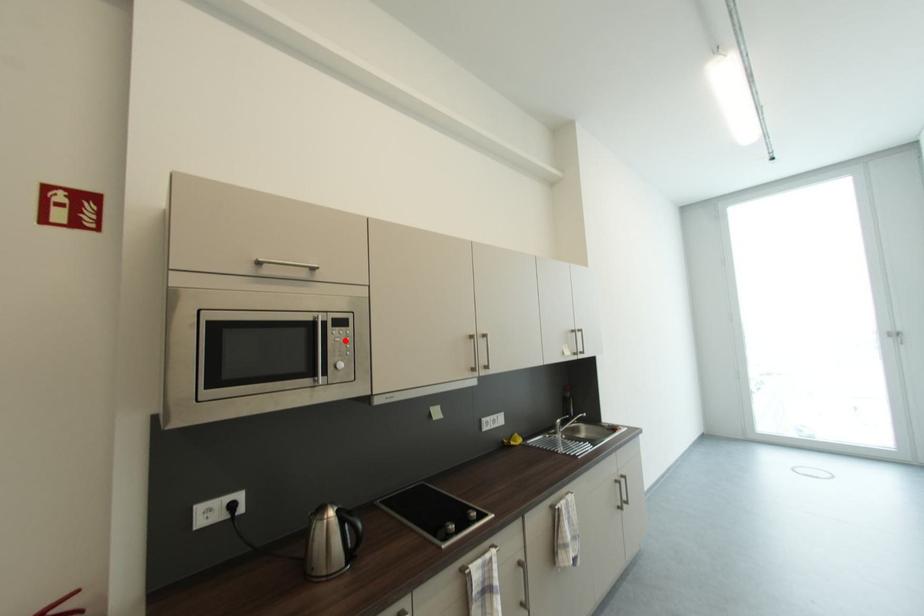
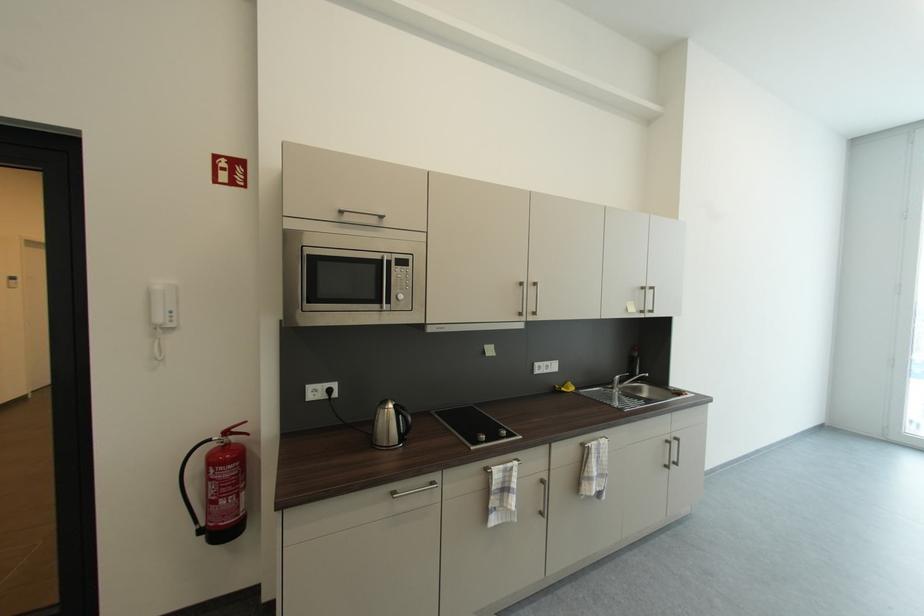
Locate, in the second image, the point that corresponds to the highlighted location in the first image.

(407, 278)